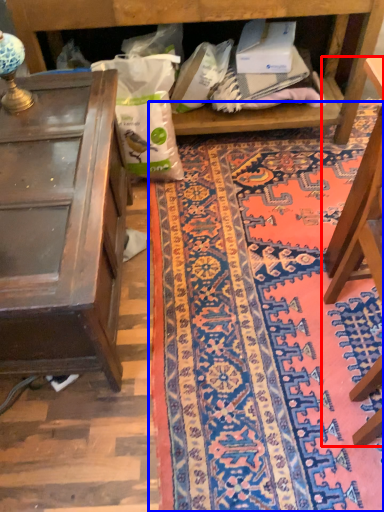
Question: Which of the following is the farthest to the observer, furniture (highlighted by a red box) or mat (highlighted by a blue box)?

Choices:
 (A) furniture
 (B) mat

Answer: (B)